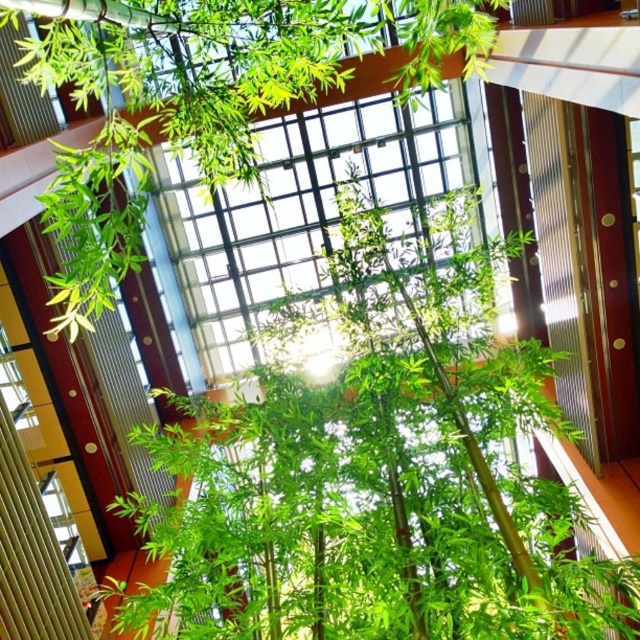
Question: Observing the image, what is the correct spatial positioning of green bamboo at center in reference to transparent glass window at center?

Choices:
 (A) right
 (B) left

Answer: (B)

Question: Is green bamboo at center smaller than transparent glass window at center?

Choices:
 (A) yes
 (B) no

Answer: (A)

Question: Which of the following is the closest to the observer?

Choices:
 (A) transparent glass window at center
 (B) clear glass window at upper left

Answer: (A)

Question: Which is farther from the green bamboo at center?

Choices:
 (A) transparent glass window at center
 (B) clear glass window at upper left

Answer: (A)

Question: Is green bamboo at center further to the viewer compared to clear glass window at upper left?

Choices:
 (A) no
 (B) yes

Answer: (A)

Question: Which point is closer to the camera taking this photo?

Choices:
 (A) (236, 637)
 (B) (80, 561)

Answer: (A)